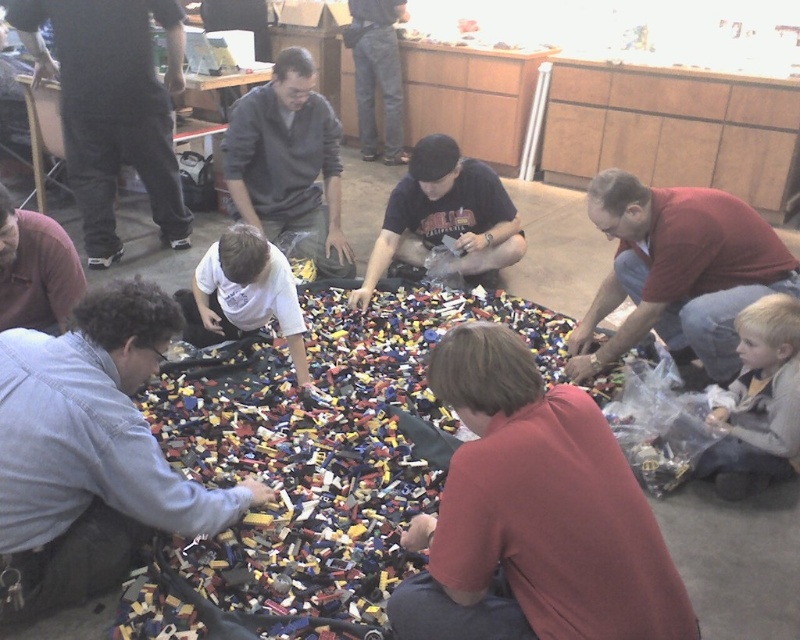
Is matte red shirt at center closer to the viewer compared to denim jeans at upper center?

Yes, matte red shirt at center is closer to the viewer.

Is point (432, 529) closer to viewer compared to point (366, 144)?

That is True.

Find the location of a particular element. The image size is (800, 640). matte red shirt at center is located at coordinates (533, 515).

Does dark gray pants at left have a lesser width compared to matte gray sweater at center?

No.

Can you confirm if dark gray pants at left is smaller than matte gray sweater at center?

No, dark gray pants at left is not smaller than matte gray sweater at center.

Find the location of a particular element. The width and height of the screenshot is (800, 640). dark gray pants at left is located at coordinates pos(112,108).

The image size is (800, 640). Describe the element at coordinates (444, 218) in the screenshot. I see `dark blue t-shirt at center` at that location.

Who is shorter, dark blue t-shirt at center or white matte shirt at center?

white matte shirt at center

Identify the location of dark blue t-shirt at center. (444, 218).